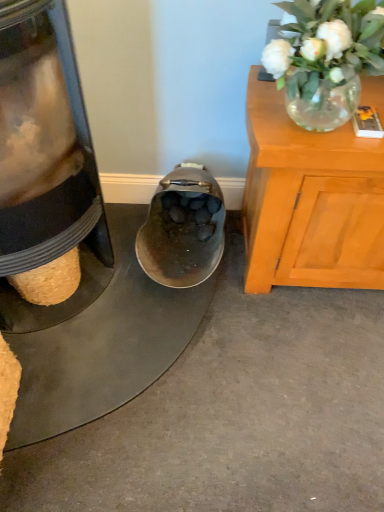
Question: Can you confirm if translucent glass vase at upper right is thinner than shiny metallic shoe at center?

Choices:
 (A) yes
 (B) no

Answer: (A)

Question: Does translucent glass vase at upper right have a greater height compared to shiny metallic shoe at center?

Choices:
 (A) yes
 (B) no

Answer: (B)

Question: Is there a large distance between translucent glass vase at upper right and shiny metallic shoe at center?

Choices:
 (A) no
 (B) yes

Answer: (A)

Question: Can you confirm if translucent glass vase at upper right is shorter than shiny metallic shoe at center?

Choices:
 (A) no
 (B) yes

Answer: (B)

Question: Is translucent glass vase at upper right oriented away from shiny metallic shoe at center?

Choices:
 (A) yes
 (B) no

Answer: (B)

Question: Do you think translucent glass vase at upper right is within shiny metallic shoe at center, or outside of it?

Choices:
 (A) inside
 (B) outside

Answer: (B)

Question: Considering the positions of translucent glass vase at upper right and shiny metallic shoe at center in the image, is translucent glass vase at upper right wider or thinner than shiny metallic shoe at center?

Choices:
 (A) wide
 (B) thin

Answer: (B)

Question: From their relative heights in the image, would you say translucent glass vase at upper right is taller or shorter than shiny metallic shoe at center?

Choices:
 (A) tall
 (B) short

Answer: (B)

Question: Visually, is translucent glass vase at upper right positioned to the left or to the right of shiny metallic shoe at center?

Choices:
 (A) right
 (B) left

Answer: (A)

Question: From a real-world perspective, is metallic bowl at center above or below shiny metallic shoe at center?

Choices:
 (A) below
 (B) above

Answer: (A)

Question: From the image's perspective, is metallic bowl at center positioned above or below shiny metallic shoe at center?

Choices:
 (A) above
 (B) below

Answer: (B)

Question: Looking at the image, does metallic bowl at center seem bigger or smaller compared to shiny metallic shoe at center?

Choices:
 (A) big
 (B) small

Answer: (B)

Question: Does point (18, 394) appear closer or farther from the camera than point (150, 239)?

Choices:
 (A) farther
 (B) closer

Answer: (B)

Question: From the image's perspective, is shiny metallic shoe at center positioned above or below translucent glass vase at upper right?

Choices:
 (A) above
 (B) below

Answer: (B)

Question: Which is correct: shiny metallic shoe at center is inside translucent glass vase at upper right, or outside of it?

Choices:
 (A) inside
 (B) outside

Answer: (B)